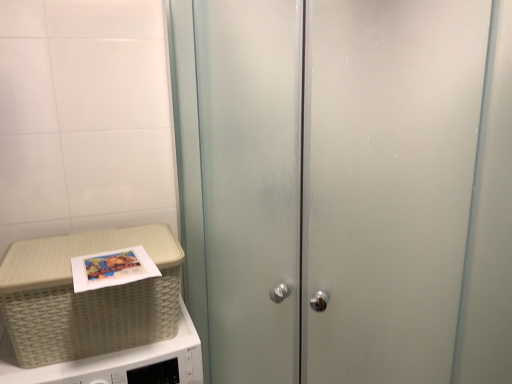
What is the approximate height of beige woven picnic basket at lower left?

The height of beige woven picnic basket at lower left is 27.96 centimeters.

Where is `white woven basket at left`? Image resolution: width=512 pixels, height=384 pixels. white woven basket at left is located at coordinates (113, 361).

What do you see at coordinates (326, 183) in the screenshot?
I see `frosted glass cabinet at center` at bounding box center [326, 183].

Measure the distance between point [443,268] and camera.

The depth of point [443,268] is 1.02 meters.

Locate an element on the screen. Image resolution: width=512 pixels, height=384 pixels. beige woven picnic basket at lower left is located at coordinates (x=87, y=297).

Are beige woven picnic basket at lower left and frosted glass cabinet at center making contact?

beige woven picnic basket at lower left and frosted glass cabinet at center are clearly separated.

Which is correct: beige woven picnic basket at lower left is inside frosted glass cabinet at center, or outside of it?

beige woven picnic basket at lower left is located beyond the bounds of frosted glass cabinet at center.

Measure the distance between beige woven picnic basket at lower left and frosted glass cabinet at center.

beige woven picnic basket at lower left and frosted glass cabinet at center are 19.34 inches apart from each other.

Does beige woven picnic basket at lower left appear on the right side of frosted glass cabinet at center?

No.

In the scene shown: Considering the sizes of white woven basket at left and frosted glass cabinet at center in the image, is white woven basket at left wider or thinner than frosted glass cabinet at center?

Clearly, white woven basket at left has less width compared to frosted glass cabinet at center.

Would you say frosted glass cabinet at center is part of white woven basket at left's contents?

No, frosted glass cabinet at center is located outside of white woven basket at left.

Is white woven basket at left not near frosted glass cabinet at center?

No.

Which of these two, white woven basket at left or frosted glass cabinet at center, stands taller?

frosted glass cabinet at center.

Who is taller, white woven basket at left or beige woven picnic basket at lower left?

white woven basket at left is taller.

Locate an element on the screen. The image size is (512, 384). picnic basket above the white woven basket at left (from a real-world perspective) is located at coordinates (87, 297).

From the image's perspective, which one is positioned lower, white woven basket at left or beige woven picnic basket at lower left?

white woven basket at left is shown below in the image.

Which object is positioned more to the right, white woven basket at left or beige woven picnic basket at lower left?

Positioned to the right is beige woven picnic basket at lower left.

Choose the correct answer: Is frosted glass cabinet at center inside beige woven picnic basket at lower left or outside it?

The correct answer is: outside.

Who is smaller, frosted glass cabinet at center or beige woven picnic basket at lower left?

Smaller between the two is beige woven picnic basket at lower left.

From the image's perspective, which is below, frosted glass cabinet at center or beige woven picnic basket at lower left?

beige woven picnic basket at lower left.

Is frosted glass cabinet at center in front of beige woven picnic basket at lower left?

Yes, frosted glass cabinet at center is closer to the viewer.

Which object is positioned more to the left, frosted glass cabinet at center or white woven basket at left?

white woven basket at left is more to the left.

Considering the relative sizes of frosted glass cabinet at center and white woven basket at left in the image provided, is frosted glass cabinet at center shorter than white woven basket at left?

No, frosted glass cabinet at center is not shorter than white woven basket at left.

Does frosted glass cabinet at center lie behind white woven basket at left?

No, frosted glass cabinet at center is in front of white woven basket at left.

Which object is more forward, beige woven picnic basket at lower left or white woven basket at left?

white woven basket at left is closer to the camera.

From a real-world perspective, which is physically above, beige woven picnic basket at lower left or white woven basket at left?

In real-world perspective, beige woven picnic basket at lower left is above.

Is beige woven picnic basket at lower left next to white woven basket at left?

No, beige woven picnic basket at lower left is not in contact with white woven basket at left.

Can you confirm if beige woven picnic basket at lower left is taller than white woven basket at left?

Result: No, beige woven picnic basket at lower left is not taller than white woven basket at left.

What are the coordinates of `door that appears on the right of beige woven picnic basket at lower left` in the screenshot? It's located at [326, 183].

This screenshot has width=512, height=384. I want to click on door in front of the white woven basket at left, so click(326, 183).

Which object lies nearer to the anchor point white woven basket at left, frosted glass cabinet at center or beige woven picnic basket at lower left?

Based on the image, beige woven picnic basket at lower left appears to be nearer to white woven basket at left.

When comparing their distances from frosted glass cabinet at center, does white woven basket at left or beige woven picnic basket at lower left seem further?

white woven basket at left is positioned further to the anchor frosted glass cabinet at center.

Based on their spatial positions, is white woven basket at left or frosted glass cabinet at center further from beige woven picnic basket at lower left?

Based on the image, frosted glass cabinet at center appears to be further to beige woven picnic basket at lower left.

Considering their positions, is beige woven picnic basket at lower left positioned closer to white woven basket at left than frosted glass cabinet at center?

The object closer to white woven basket at left is beige woven picnic basket at lower left.

Estimate the real-world distances between objects in this image. Which object is further from beige woven picnic basket at lower left, frosted glass cabinet at center or white woven basket at left?

frosted glass cabinet at center.

When comparing their distances from frosted glass cabinet at center, does beige woven picnic basket at lower left or white woven basket at left seem further?

white woven basket at left is further to frosted glass cabinet at center.

This screenshot has width=512, height=384. I want to click on picnic basket between white woven basket at left and frosted glass cabinet at center from left to right, so click(87, 297).